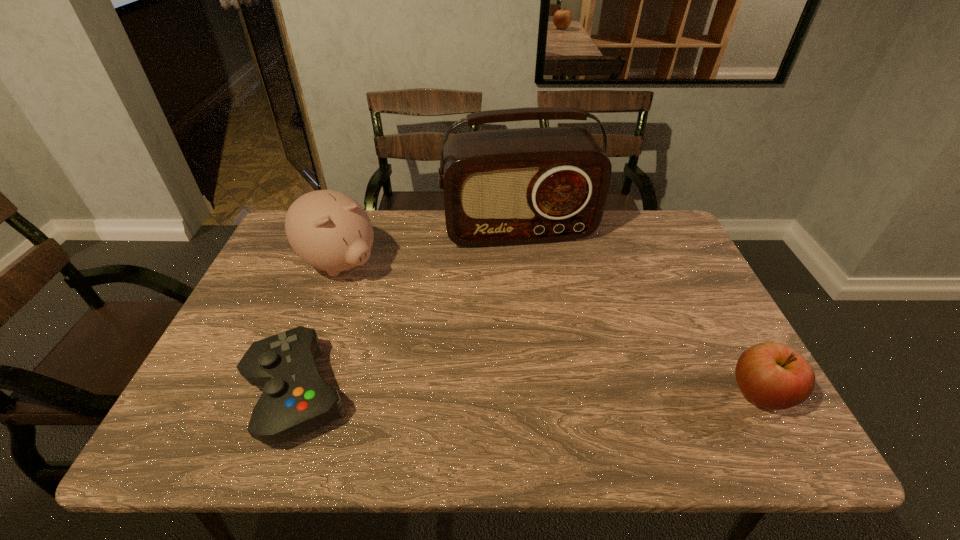
Locate an element on the screen. This screenshot has height=540, width=960. the shortest object is located at coordinates (296, 400).

Image resolution: width=960 pixels, height=540 pixels. Identify the location of the rightmost object. (772, 375).

Identify the location of the third tallest object. (x=772, y=375).

Find the location of `the second tallest object`. the second tallest object is located at coordinates (330, 231).

At what (x,y) coordinates should I click in order to perform the action: click on the tallest object. Please return your answer as a coordinate pair (x, y). Image resolution: width=960 pixels, height=540 pixels. Looking at the image, I should click on (501, 187).

Locate an element on the screen. The height and width of the screenshot is (540, 960). radio receiver is located at coordinates (501, 187).

This screenshot has height=540, width=960. I want to click on vacant space located on the back of the control, so tap(328, 303).

Identify the location of free region located on the left of the rightmost object. The image size is (960, 540). (691, 393).

You are a GUI agent. You are given a task and a screenshot of the screen. Output one action in this format:
    pyautogui.click(x=<x>, y=<y>)
    Task: Click on the free point located 0.220m at the snout of the third shortest object
    The image size is (960, 540).
    Given the screenshot: What is the action you would take?
    pyautogui.click(x=418, y=323)

Where is `free location located at the snout of the third shortest object`? The width and height of the screenshot is (960, 540). free location located at the snout of the third shortest object is located at coordinates (390, 302).